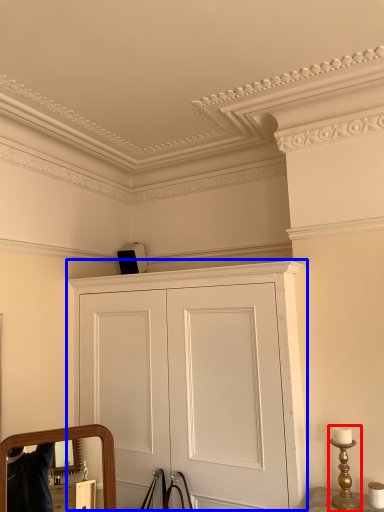
Question: Which point is further to the camera, table lamp (highlighted by a red box) or cupboard (highlighted by a blue box)?

Choices:
 (A) table lamp
 (B) cupboard

Answer: (A)